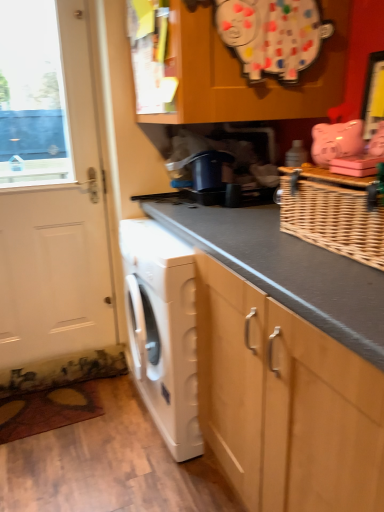
Question: Is white matte door at left far away from white matte washing machine at lower left?

Choices:
 (A) yes
 (B) no

Answer: (B)

Question: Is white matte door at left in front of white matte washing machine at lower left?

Choices:
 (A) no
 (B) yes

Answer: (A)

Question: Considering the relative sizes of white matte door at left and white matte washing machine at lower left in the image provided, is white matte door at left wider than white matte washing machine at lower left?

Choices:
 (A) yes
 (B) no

Answer: (B)

Question: Is white matte door at left facing away from white matte washing machine at lower left?

Choices:
 (A) no
 (B) yes

Answer: (A)

Question: Is white matte washing machine at lower left located within white matte door at left?

Choices:
 (A) no
 (B) yes

Answer: (A)

Question: Considering the relative sizes of white matte door at left and white matte washing machine at lower left in the image provided, is white matte door at left shorter than white matte washing machine at lower left?

Choices:
 (A) yes
 (B) no

Answer: (B)

Question: Is wooden cabinet at upper center outside white matte washing machine at lower left?

Choices:
 (A) no
 (B) yes

Answer: (B)

Question: Does wooden cabinet at upper center have a larger size compared to white matte washing machine at lower left?

Choices:
 (A) yes
 (B) no

Answer: (B)

Question: Does wooden cabinet at upper center have a greater height compared to white matte washing machine at lower left?

Choices:
 (A) yes
 (B) no

Answer: (B)

Question: From the image's perspective, is wooden cabinet at upper center above white matte washing machine at lower left?

Choices:
 (A) yes
 (B) no

Answer: (A)

Question: Is wooden cabinet at upper center positioned behind white matte washing machine at lower left?

Choices:
 (A) yes
 (B) no

Answer: (B)

Question: Is white matte washing machine at lower left located within wooden cabinet at upper center?

Choices:
 (A) yes
 (B) no

Answer: (B)

Question: Is woven brown basket at upper right further to the viewer compared to white matte washing machine at lower left?

Choices:
 (A) no
 (B) yes

Answer: (A)